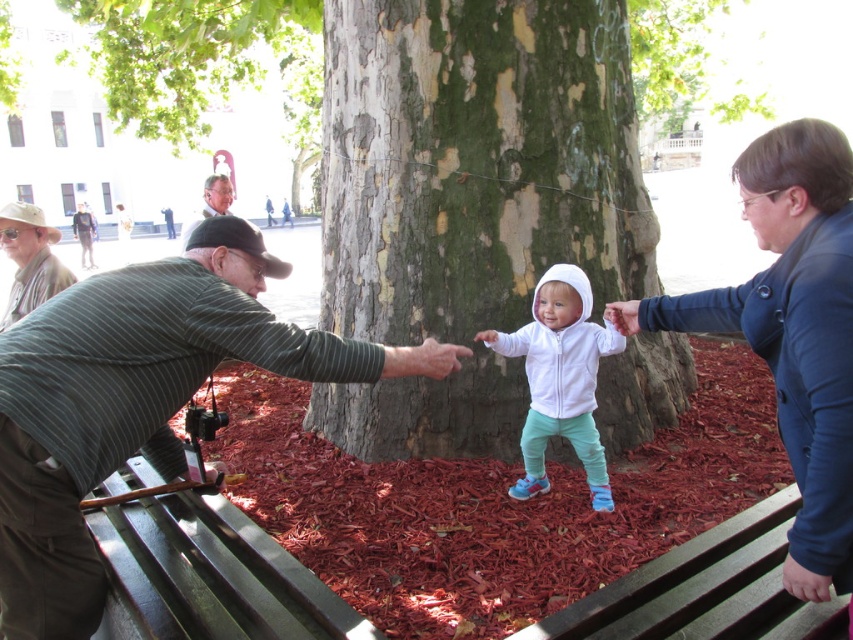
Question: Is green bark tree trunk at center closer to the viewer compared to khaki cotton hat at left?

Choices:
 (A) yes
 (B) no

Answer: (A)

Question: Based on their relative distances, which object is farther from the green bark tree trunk at center?

Choices:
 (A) blue fabric jacket at center
 (B) striped fabric shirt at left

Answer: (B)

Question: Which of these objects is positioned farthest from the matte black cap at left?

Choices:
 (A) green bark tree trunk at center
 (B) striped fabric shirt at left
 (C) khaki cotton hat at left
 (D) white fleece jacket at center

Answer: (C)

Question: Can you confirm if striped fabric shirt at left is positioned to the right of khaki cotton hat at left?

Choices:
 (A) yes
 (B) no

Answer: (A)

Question: Which point is closer to the camera?

Choices:
 (A) (772, 196)
 (B) (53, 285)
 (C) (367, 376)
 (D) (585, 374)

Answer: (A)

Question: Does green bark tree trunk at center appear over matte black cap at left?

Choices:
 (A) no
 (B) yes

Answer: (A)